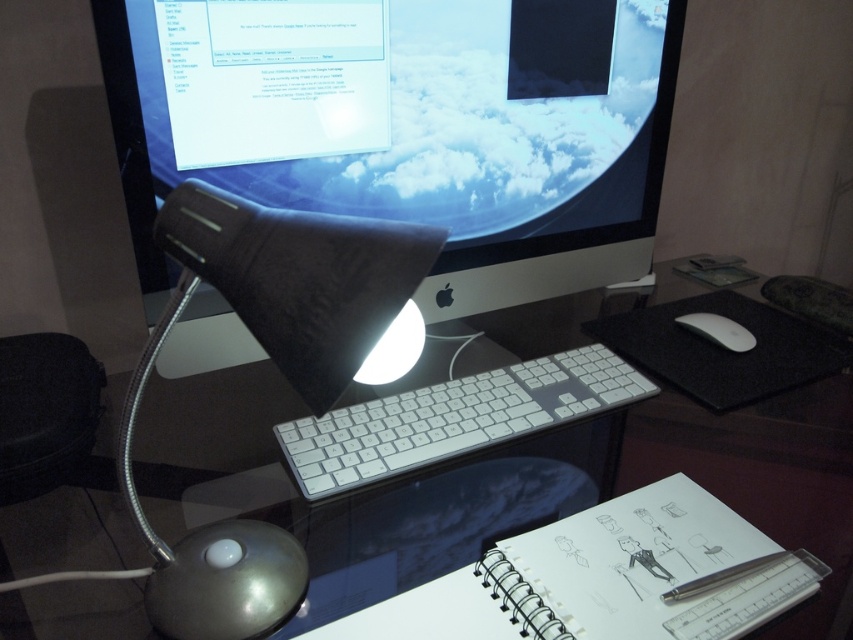
You are organizing your desk and want to place a new 10cm wide object between the matte black lamp at left and the white paper notepad at right. Can you fit it there?

The matte black lamp at left has a lesser width compared to white paper notepad at right. Since the lamp is narrower, there should be enough space between them to fit a 10cm wide object.

You are organizing the desk and want to place a new object between the matte black lamp at left and the white paper notepad at right. Is there enough space between them to fit a standard 15cm ruler?

The matte black lamp at left is in front of the white paper notepad at right, meaning they are aligned along the depth axis rather than side by side. Since the ruler requires horizontal space between them, there isn

You are a virtual assistant trying to determine the best path to move an object from point A to point B in this workspace. Point A is at point (515, 316) and point B is at point (720, 576). Considering the spatial relationship between these two points, which direction should you move first to reach point B from point A without going through the iMac screen?

Point (515, 316) is closer to the viewer than point (720, 576). To reach point B from point A without going through the iMac screen, you should first move away from the viewer towards the iMac screen, then adjust your position to the right and upwards to reach point B.